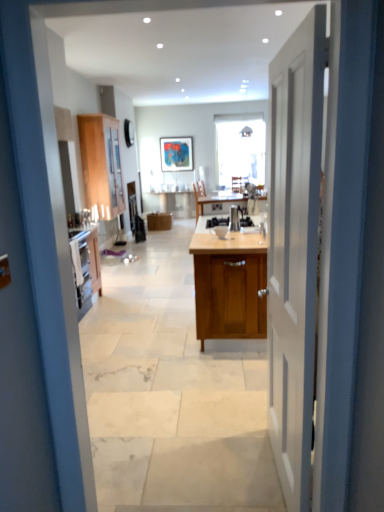
Where is `free region under white wooden door at center (from a real-world perspective)`? free region under white wooden door at center (from a real-world perspective) is located at coordinates (271, 463).